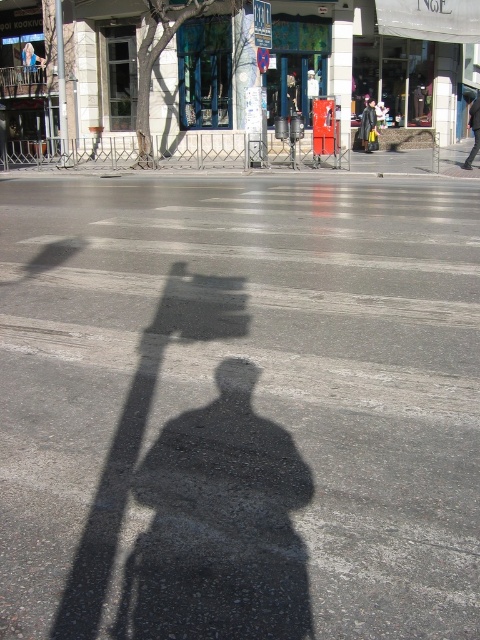
Question: Estimate the real-world distances between objects in this image. Which object is farther from the metallic blue street sign at upper center?

Choices:
 (A) brushed metal pole at upper left
 (B) black leather jacket at center
 (C) dark gray pants at center
 (D) black shadow at center

Answer: (D)

Question: Which of the following is the farthest from the observer?

Choices:
 (A) brushed metal pole at upper left
 (B) metallic blue street sign at upper center

Answer: (A)

Question: Does black shadow at center come behind dark gray pants at center?

Choices:
 (A) yes
 (B) no

Answer: (B)

Question: Can you confirm if metallic blue street sign at upper center is positioned to the right of dark gray pants at center?

Choices:
 (A) no
 (B) yes

Answer: (A)

Question: Based on their relative distances, which object is farther from the dark gray pants at center?

Choices:
 (A) black shadow at center
 (B) brushed metal pole at upper left
 (C) black leather jacket at center
 (D) metallic blue street sign at upper center

Answer: (A)

Question: Can you confirm if black shadow at center is positioned to the left of black leather jacket at center?

Choices:
 (A) no
 (B) yes

Answer: (B)